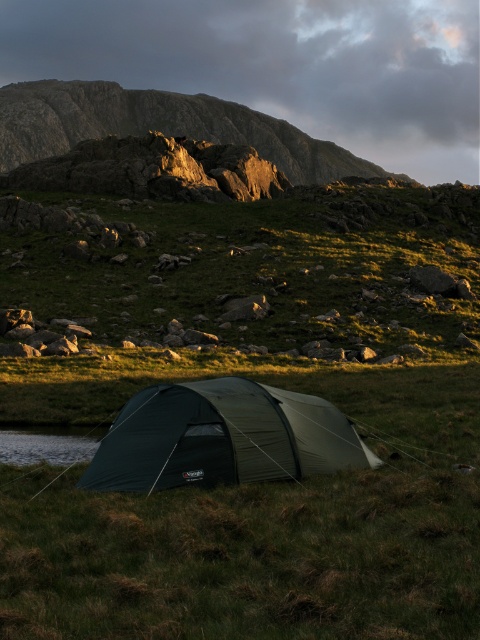
You are planning to set up a campsite for a group of hikers. You have a green fabric tent at center and a rugged stone hillside at upper center in the area. Considering the distance between them, can you safely place the tent closer to the hillside without risking it being too far from the hikers gathering point at the hillside?

The green fabric tent at center and rugged stone hillside at upper center are 431.05 feet apart. This distance is quite significant, so placing the tent closer to the hillside would still keep it a considerable distance from the hikers gathering point at the hillside. However, the exact feasibility depends on the available space between them, but based on the given distance, it might not be close enough for convenience.

You are planning to set up a new tent in this camping area. The new tent is wider than the existing green fabric tent at center. Based on the scene, can the rugged stone hillside at upper center accommodate the new wider tent? Please explain your reasoning.

The green fabric tent at center has a lesser width compared to the rugged stone hillside at upper center. Since the new tent is wider than the existing one, but the hillside is already wider than the current tent, there is sufficient space for the new tent provided it aligns with the available area on the hillside.

In the scene shown: You are planning to set up a new tent in this camping area. The existing green fabric tent at center is already occupying a spot at coordinates 0.684, 0.463. If you want to place your tent 1.5 meters away from it in the direction of the mountain, will there be enough space? Please consider the terrain and existing objects.

The green fabric tent at center is located at coordinates (222, 436). Since the scene description mentions a rugged mountainous backdrop and a rocky outcrop in the middle ground, placing the tent 1.5 meters towards the mountain may encounter uneven terrain or rocks, making it difficult to set up safely. Check the area for flat ground before proceeding.